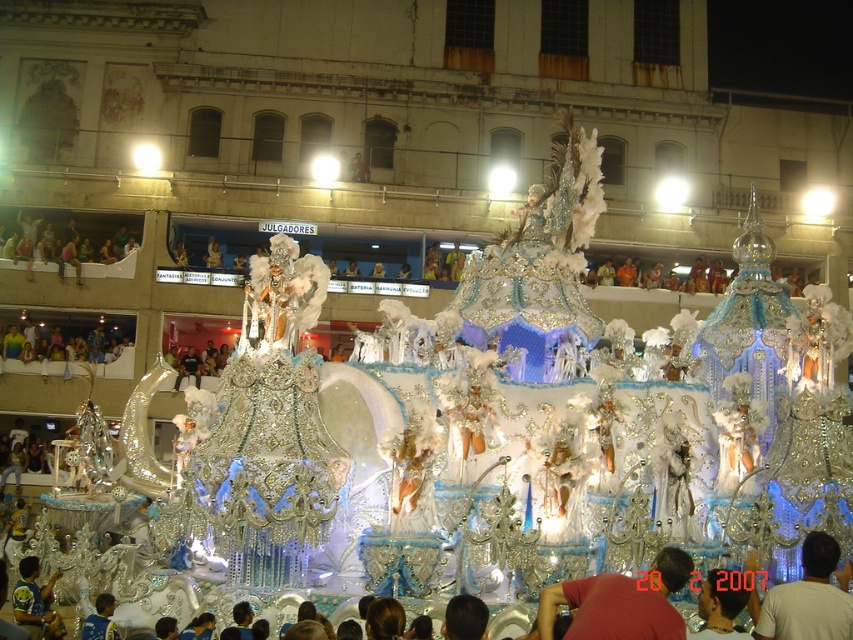
You are a photographer at the carnival event. You want to capture a photo where both the silver metallic helmet at center and the blue jersey at lower left are visible. Which object should you focus on first to ensure both are in frame?

You should focus on the blue jersey at lower left first because it is larger and will be easier to frame, ensuring the smaller silver metallic helmet at center is also captured in the shot.

You are a photographer at the carnival trying to capture a clear shot of the float. You notice the matte white figure at center and the blue jersey at lower left in your viewfinder. Which object should you focus on to ensure the other is not blocking the float?

The matte white figure at center is in front of the blue jersey at lower left. To ensure the blue jersey at lower left is not blocking the float, you should focus on the matte white figure at center since it is closer and obscuring the view.